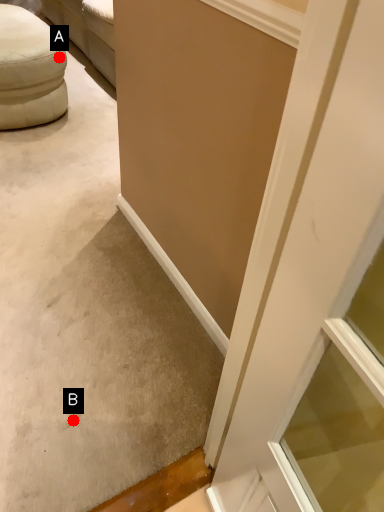
Question: Two points are circled on the image, labeled by A and B beside each circle. Which point is farther to the camera?

Choices:
 (A) A is further
 (B) B is further

Answer: (A)